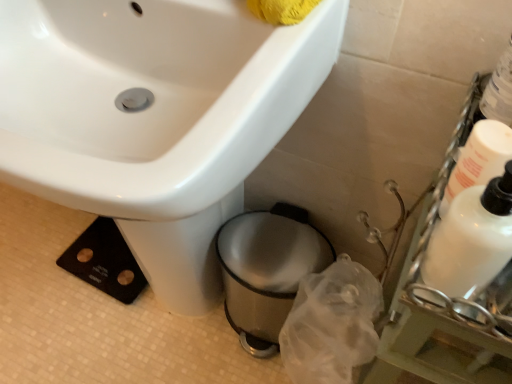
Question: Is white glossy bottle at right, the 1th cleaning product when ordered from left to right, completely or partially inside white glossy bottle at right, the second cleaning product viewed from the left?

Choices:
 (A) no
 (B) yes

Answer: (A)

Question: Is white glossy bottle at right, the second cleaning product viewed from the left, wider than white glossy bottle at right, acting as the 2th cleaning product starting from the right?

Choices:
 (A) yes
 (B) no

Answer: (A)

Question: From the image's perspective, is white glossy bottle at right, the 1th cleaning product when ordered from right to left, below white glossy bottle at right, acting as the 2th cleaning product starting from the right?

Choices:
 (A) no
 (B) yes

Answer: (A)

Question: Could you tell me if white glossy bottle at right, the second cleaning product viewed from the left, is facing white glossy bottle at right, acting as the 2th cleaning product starting from the right?

Choices:
 (A) yes
 (B) no

Answer: (B)

Question: From a real-world perspective, is white glossy bottle at right, the 1th cleaning product when ordered from right to left, positioned over white glossy bottle at right, acting as the 2th cleaning product starting from the right, based on gravity?

Choices:
 (A) yes
 (B) no

Answer: (B)

Question: Considering the relative sizes of white glossy bottle at right, the second cleaning product viewed from the left, and white glossy bottle at right, acting as the 2th cleaning product starting from the right, in the image provided, is white glossy bottle at right, the second cleaning product viewed from the left, thinner than white glossy bottle at right, acting as the 2th cleaning product starting from the right,?

Choices:
 (A) yes
 (B) no

Answer: (B)

Question: Does white glossy bottle at right, the 1th cleaning product when ordered from right to left, contain shiny metallic trash can at lower center?

Choices:
 (A) yes
 (B) no

Answer: (B)

Question: Considering the relative sizes of white glossy bottle at right, the 1th cleaning product when ordered from right to left, and shiny metallic trash can at lower center in the image provided, is white glossy bottle at right, the 1th cleaning product when ordered from right to left, taller than shiny metallic trash can at lower center?

Choices:
 (A) no
 (B) yes

Answer: (A)

Question: From the image's perspective, is white glossy bottle at right, the second cleaning product viewed from the left, on top of shiny metallic trash can at lower center?

Choices:
 (A) yes
 (B) no

Answer: (A)

Question: Is white glossy bottle at right, the second cleaning product viewed from the left, next to shiny metallic trash can at lower center?

Choices:
 (A) yes
 (B) no

Answer: (B)

Question: Is white glossy bottle at right, the 1th cleaning product when ordered from right to left, facing away from shiny metallic trash can at lower center?

Choices:
 (A) yes
 (B) no

Answer: (B)

Question: Would you say white glossy bottle at right, the 1th cleaning product when ordered from right to left, is outside shiny metallic trash can at lower center?

Choices:
 (A) yes
 (B) no

Answer: (A)

Question: Does shiny metallic trash can at lower center turn towards white glossy sink at upper left?

Choices:
 (A) no
 (B) yes

Answer: (B)